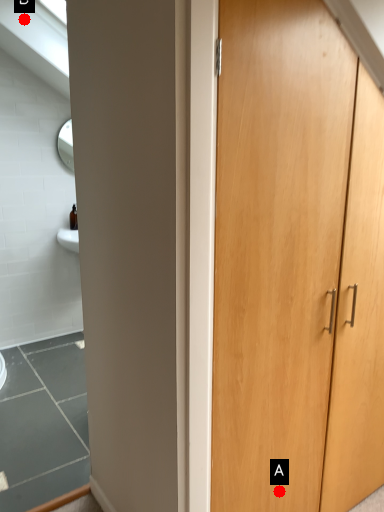
Question: Two points are circled on the image, labeled by A and B beside each circle. Among these points, which one is farthest from the camera?

Choices:
 (A) A is further
 (B) B is further

Answer: (B)